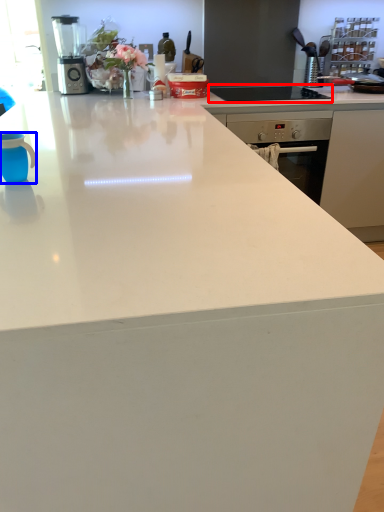
Question: Which of the following is the closest to the observer, gas stove (highlighted by a red box) or mug (highlighted by a blue box)?

Choices:
 (A) gas stove
 (B) mug

Answer: (B)